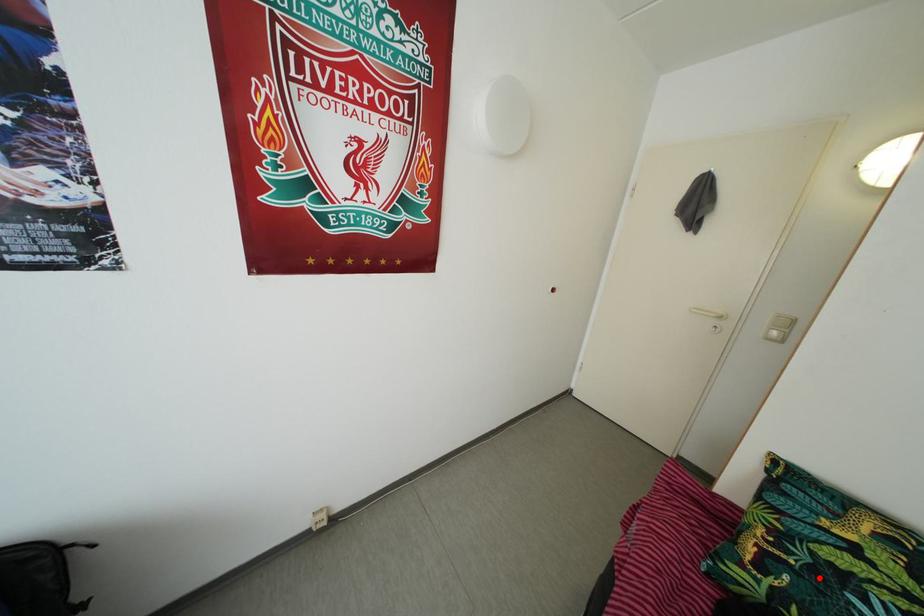
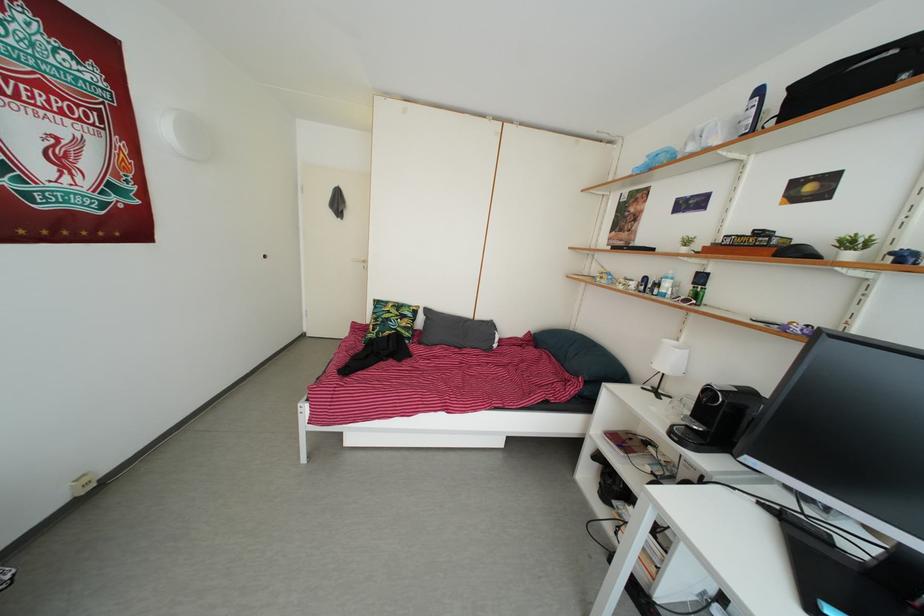
The point at the highlighted location is marked in the first image. Where is the corresponding point in the second image?

(388, 330)